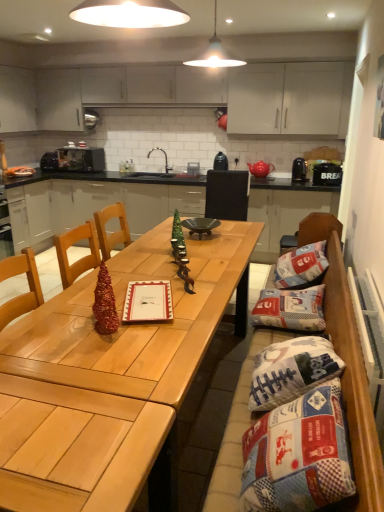
Locate an element on the screen. The height and width of the screenshot is (512, 384). free location in front of green matte christmas tree at center, the 1th christmas tree in the top-to-bottom sequence is located at coordinates (187, 264).